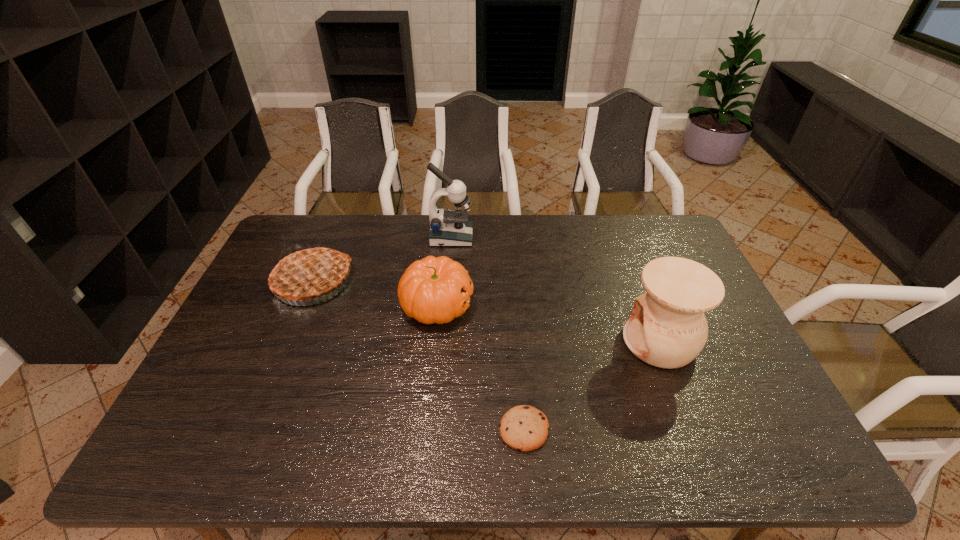
At what (x,y) coordinates should I click in order to perform the action: click on the farthest object. Please return your answer as a coordinate pair (x, y). The image size is (960, 540). Looking at the image, I should click on [x=448, y=227].

Identify the location of microscope. (448, 227).

Identify the location of the fourth shortest object. Image resolution: width=960 pixels, height=540 pixels. (667, 328).

Locate an element on the screen. the rightmost object is located at coordinates (667, 328).

Find the location of `the leftmost object`. the leftmost object is located at coordinates (307, 273).

Locate an element on the screen. Image resolution: width=960 pixels, height=540 pixels. pie is located at coordinates (307, 273).

Identify the location of pumpkin. Image resolution: width=960 pixels, height=540 pixels. (432, 290).

The image size is (960, 540). What are the coordinates of `cookie` in the screenshot? It's located at (523, 427).

Locate an element on the screen. the shortest object is located at coordinates (523, 427).

Locate an element on the screen. The height and width of the screenshot is (540, 960). vacant space located at the eyepiece of the tallest object is located at coordinates (497, 238).